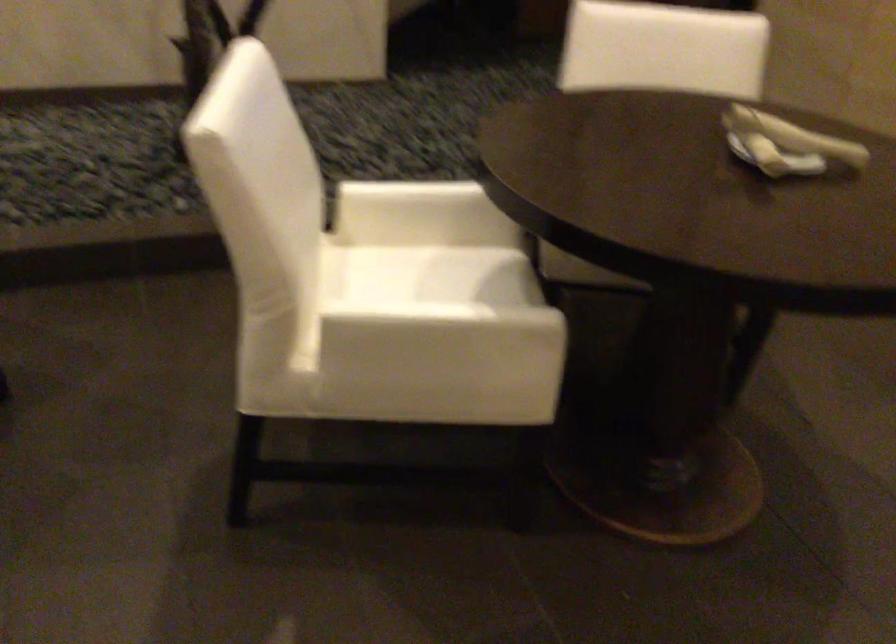
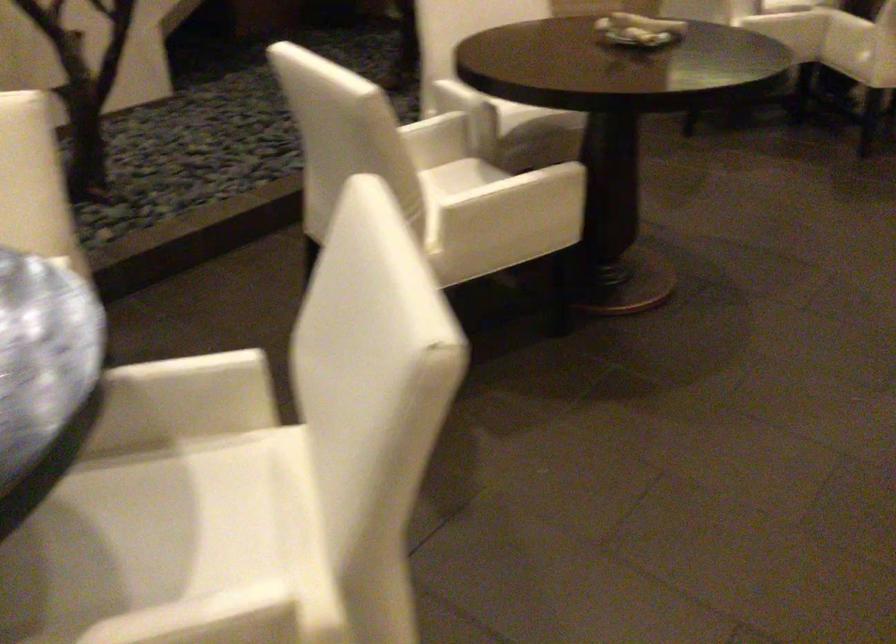
Find the pixel in the second image that matches point 436,333 in the first image.

(513, 196)